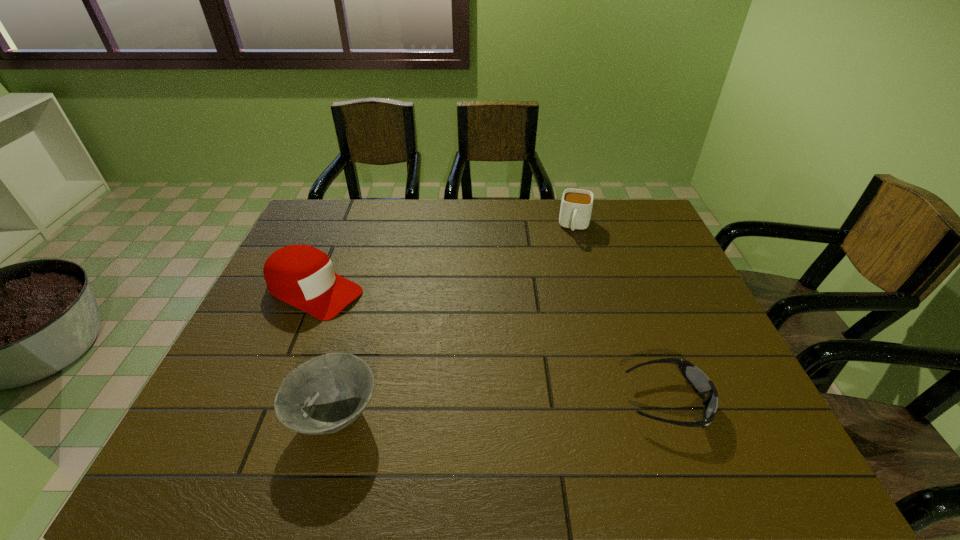
Locate an element on the screen. free space between the sunglasses and the bowl is located at coordinates (501, 409).

Locate an element on the screen. Image resolution: width=960 pixels, height=540 pixels. object that stands as the second closest to the bowl is located at coordinates (701, 384).

Identify which object is the second closest to the bowl. Please provide its 2D coordinates. Your answer should be formatted as a tuple, i.e. [(x, y)], where the tuple contains the x and y coordinates of a point satisfying the conditions above.

[(701, 384)]

Image resolution: width=960 pixels, height=540 pixels. I want to click on vacant region that satisfies the following two spatial constraints: 1. on the front side of the bowl; 2. on the left side of the second farthest object, so click(x=261, y=416).

This screenshot has height=540, width=960. I want to click on free space that satisfies the following two spatial constraints: 1. on the back side of the shortest object; 2. on the lenses of the bowl, so click(x=339, y=401).

I want to click on blank space that satisfies the following two spatial constraints: 1. on the back side of the farthest object; 2. on the right side of the bowl, so click(x=388, y=226).

This screenshot has height=540, width=960. In order to click on free location that satisfies the following two spatial constraints: 1. on the back side of the cup; 2. on the left side of the baseball cap in this screenshot , I will do 341,226.

Where is `free space that satisfies the following two spatial constraints: 1. on the front side of the baseball cap; 2. on the lenses of the sunglasses`? The height and width of the screenshot is (540, 960). free space that satisfies the following two spatial constraints: 1. on the front side of the baseball cap; 2. on the lenses of the sunglasses is located at coordinates (268, 401).

What are the coordinates of `free space that satisfies the following two spatial constraints: 1. on the back side of the bowl; 2. on the lenses of the sunglasses` in the screenshot? It's located at (339, 401).

Where is `free space that satisfies the following two spatial constraints: 1. on the back side of the farthest object; 2. on the left side of the bowl`? This screenshot has height=540, width=960. free space that satisfies the following two spatial constraints: 1. on the back side of the farthest object; 2. on the left side of the bowl is located at coordinates (388, 226).